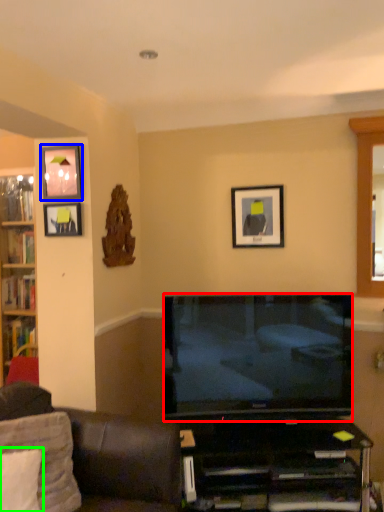
Question: Estimate the real-world distances between objects in this image. Which object is closer to television (highlighted by a red box), picture frame (highlighted by a blue box) or pillow (highlighted by a green box)?

Choices:
 (A) picture frame
 (B) pillow

Answer: (B)